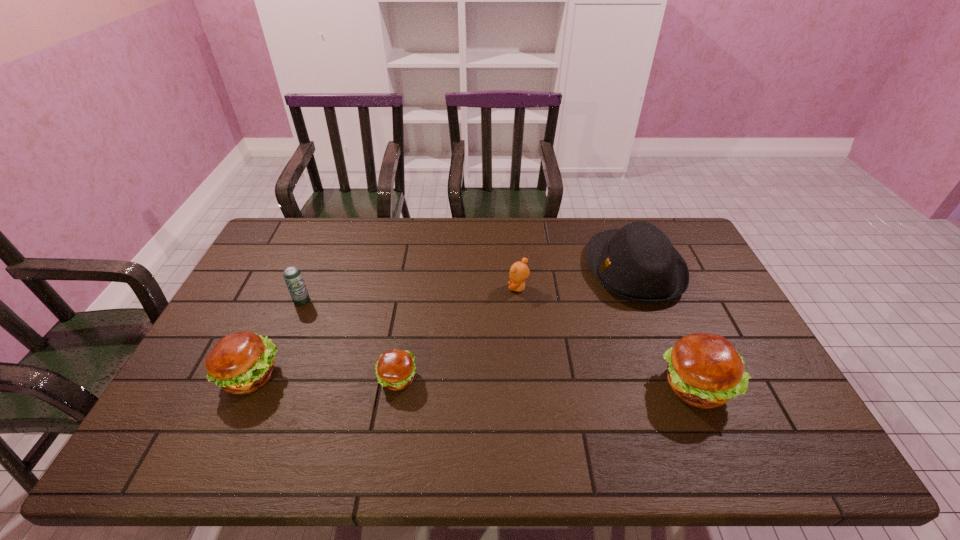
At what (x,y) coordinates should I click in order to perform the action: click on the leftmost hamburger. Please return your answer as a coordinate pair (x, y). Image resolution: width=960 pixels, height=540 pixels. Looking at the image, I should click on (240, 363).

In order to click on the fourth object from right to left in this screenshot , I will do `click(395, 369)`.

Find the location of a particular element. The image size is (960, 540). the shortest hamburger is located at coordinates pos(395,369).

Where is `the rightmost hamburger`? the rightmost hamburger is located at coordinates coord(704,370).

You are a GUI agent. You are given a task and a screenshot of the screen. Output one action in this format:
    pyautogui.click(x=<x>, y=<y>)
    Task: Click on the beer can
    The image size is (960, 540).
    Given the screenshot: What is the action you would take?
    pyautogui.click(x=292, y=275)

Image resolution: width=960 pixels, height=540 pixels. Identify the location of fedora. (637, 263).

The width and height of the screenshot is (960, 540). I want to click on teddy bear, so tap(519, 272).

The height and width of the screenshot is (540, 960). I want to click on free space located on the right of the second shortest hamburger, so click(x=338, y=375).

This screenshot has width=960, height=540. What are the coordinates of `vacant space located 0.150m on the back of the third object from left to right` in the screenshot? It's located at (407, 321).

At what (x,y) coordinates should I click in order to perform the action: click on vacant space located on the left of the rightmost hamburger. Please return your answer as a coordinate pair (x, y). The width and height of the screenshot is (960, 540). Looking at the image, I should click on (548, 386).